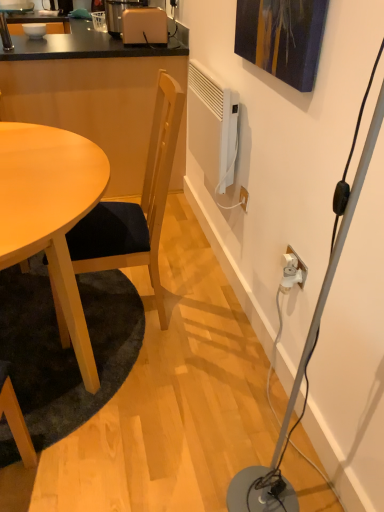
Image resolution: width=384 pixels, height=512 pixels. Identify the location of vacant space that is to the left of matte beige toaster at upper center. (110, 42).